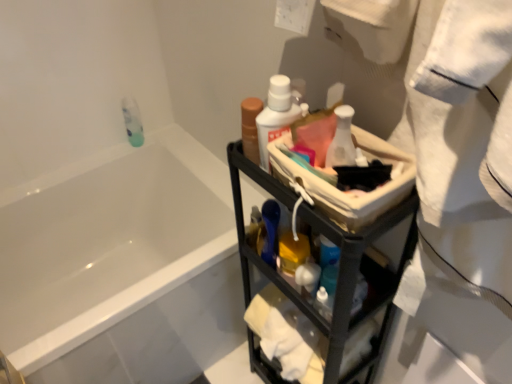
Locate an element on the screen. Image resolution: width=512 pixels, height=384 pixels. matte brown bottle at upper right, which is counted as the second mouthwash, starting from the right is located at coordinates (250, 127).

The image size is (512, 384). Describe the element at coordinates (340, 265) in the screenshot. I see `black metal cart at center` at that location.

Image resolution: width=512 pixels, height=384 pixels. What are the coordinates of `matte brown bottle at upper right, which ranks as the second mouthwash in back-to-front order` in the screenshot? It's located at (250, 127).

Which object is positioned more to the left, black metal cart at center or white glossy bathtub at upper left?

white glossy bathtub at upper left is more to the left.

Is white glossy bathtub at upper left surrounded by black metal cart at center?

No, white glossy bathtub at upper left is not inside black metal cart at center.

Locate an element on the screen. The height and width of the screenshot is (384, 512). bathtub below the black metal cart at center (from a real-world perspective) is located at coordinates (122, 266).

From the image's perspective, which is above, black metal cart at center or white glossy bathtub at upper left?

From the image's view, white glossy bathtub at upper left is above.

Is white cotton towel at right not within white glossy bottle at center?

white cotton towel at right is positioned outside white glossy bottle at center.

Considering the positions of objects white cotton towel at right and white glossy bottle at center in the image provided, who is behind, white cotton towel at right or white glossy bottle at center?

white glossy bottle at center is further away from the camera.

Between white cotton towel at right and white glossy bottle at center, which one has larger width?

Wider between the two is white cotton towel at right.

From the image's perspective, is white cotton towel at right positioned above or below white glossy bottle at center?

From the image's perspective, white cotton towel at right appears below white glossy bottle at center.

Between point (344, 234) and point (345, 112), which one is positioned in front?

The point (344, 234) is in front.

Is there a large distance between black metal cart at center and white glossy bottle at center?

No, there isn't a large distance between black metal cart at center and white glossy bottle at center.

Consider the image. Considering the sizes of objects black metal cart at center and white glossy bottle at center in the image provided, who is smaller, black metal cart at center or white glossy bottle at center?

white glossy bottle at center.

Which object is positioned more to the left, black metal cart at center or white glossy bottle at center?

From the viewer's perspective, white glossy bottle at center appears more on the left side.

From the image's perspective, is black metal cart at center on top of white cotton towel at right?

Incorrect, from the image's perspective, black metal cart at center is lower than white cotton towel at right.

Does black metal cart at center appear on the left side of white cotton towel at right?

Yes, black metal cart at center is to the left of white cotton towel at right.

At what (x,y) coordinates should I click in order to perform the action: click on bath towel lying on the right of black metal cart at center. Please return your answer as a coordinate pair (x, y). Looking at the image, I should click on (462, 177).

Does point (267, 370) appear closer or farther from the camera than point (408, 78)?

Point (267, 370).

Could you tell me if matte brown bottle at upper right, the second mouthwash positioned from the left, is turned towards white glossy bathtub at upper left?

No, matte brown bottle at upper right, the second mouthwash positioned from the left, is not aimed at white glossy bathtub at upper left.

Is matte brown bottle at upper right, which ranks as the second mouthwash in back-to-front order, outside of white glossy bathtub at upper left?

That's correct, matte brown bottle at upper right, which ranks as the second mouthwash in back-to-front order, is outside of white glossy bathtub at upper left.

Which object is positioned more to the right, matte brown bottle at upper right, the 2th mouthwash when ordered from front to back, or white glossy bathtub at upper left?

From the viewer's perspective, matte brown bottle at upper right, the 2th mouthwash when ordered from front to back, appears more on the right side.

Would you say matte brown bottle at upper right, the second mouthwash positioned from the left, is inside or outside white glossy bottle at center?

matte brown bottle at upper right, the second mouthwash positioned from the left, cannot be found inside white glossy bottle at center.

In the scene shown: In the image, is matte brown bottle at upper right, the 2th mouthwash when ordered from front to back, positioned in front of or behind white glossy bottle at center?

matte brown bottle at upper right, the 2th mouthwash when ordered from front to back, is positioned farther from the viewer than white glossy bottle at center.

From the image's perspective, which object appears higher, matte brown bottle at upper right, which ranks as the second mouthwash in back-to-front order, or white glossy bottle at center?

From the image's view, matte brown bottle at upper right, which ranks as the second mouthwash in back-to-front order, is above.

Is white glossy bathtub at upper left taller or shorter than white glossy bottle at upper center, which appears as the 3th mouthwash when viewed from the back?

Clearly, white glossy bathtub at upper left is taller compared to white glossy bottle at upper center, which appears as the 3th mouthwash when viewed from the back.

Is white glossy bathtub at upper left at the right side of white glossy bottle at upper center, which appears as the 3th mouthwash when viewed from the back?

In fact, white glossy bathtub at upper left is to the left of white glossy bottle at upper center, which appears as the 3th mouthwash when viewed from the back.

Is white glossy bathtub at upper left inside the boundaries of white glossy bottle at upper center, which is the third mouthwash in left-to-right order, or outside?

white glossy bathtub at upper left cannot be found inside white glossy bottle at upper center, which is the third mouthwash in left-to-right order.

The image size is (512, 384). I want to click on furniture on the right of white glossy bathtub at upper left, so click(x=340, y=265).

Locate an element on the screen. The height and width of the screenshot is (384, 512). toiletry behind the white cotton towel at right is located at coordinates (342, 140).

Looking at the image, which one is located further to white glossy bathtub at upper left, white cotton towel at right or black metal cart at center?

white cotton towel at right lies further to white glossy bathtub at upper left than the other object.

When comparing their distances from translucent plastic mouthwash at upper left, the 3th mouthwash from the right, does matte brown bottle at upper right, which ranks as the second mouthwash in back-to-front order, or white glossy bottle at upper center, which appears as the 3th mouthwash when viewed from the back, seem further?

Based on the image, white glossy bottle at upper center, which appears as the 3th mouthwash when viewed from the back, appears to be further to translucent plastic mouthwash at upper left, the 3th mouthwash from the right.

Considering their positions, is white glossy bottle at center positioned further to white glossy bathtub at upper left than translucent plastic mouthwash at upper left, the 3th mouthwash from the right?

The object further to white glossy bathtub at upper left is white glossy bottle at center.

Based on their spatial positions, is black metal cart at center or translucent plastic mouthwash at upper left, which appears as the third mouthwash when viewed from the front, closer to white glossy bottle at center?

The object closer to white glossy bottle at center is black metal cart at center.

From the image, which object appears to be farther from translucent plastic mouthwash at upper left, the 1th mouthwash from the back, white cotton towel at right or black metal cart at center?

white cotton towel at right is further to translucent plastic mouthwash at upper left, the 1th mouthwash from the back.

Considering their positions, is white glossy bathtub at upper left positioned closer to white glossy bottle at center than black metal cart at center?

The object closer to white glossy bottle at center is black metal cart at center.

Looking at the image, which one is located further to translucent plastic mouthwash at upper left, the 3th mouthwash from the right, white glossy bathtub at upper left or white glossy bottle at center?

Among the two, white glossy bottle at center is located further to translucent plastic mouthwash at upper left, the 3th mouthwash from the right.

Based on their spatial positions, is white cotton towel at right or matte brown bottle at upper right, the second mouthwash positioned from the left, further from white glossy bathtub at upper left?

white cotton towel at right.

You are a GUI agent. You are given a task and a screenshot of the screen. Output one action in this format:
    pyautogui.click(x=<x>, y=<y>)
    Task: Click on the bathtub positioned between black metal cart at center and translucent plastic mouthwash at upper left, the 1th mouthwash from the back, from near to far
    The width and height of the screenshot is (512, 384).
    Given the screenshot: What is the action you would take?
    pyautogui.click(x=122, y=266)

At what (x,y) coordinates should I click in order to perform the action: click on mouthwash between white cotton towel at right and matte brown bottle at upper right, which ranks as the second mouthwash in back-to-front order, in the front-back direction. Please return your answer as a coordinate pair (x, y). Looking at the image, I should click on (275, 115).

You are a GUI agent. You are given a task and a screenshot of the screen. Output one action in this format:
    pyautogui.click(x=<x>, y=<y>)
    Task: Click on the bathtub between white cotton towel at right and translucent plastic mouthwash at upper left, which appears as the third mouthwash when viewed from the front, in the front-back direction
    The width and height of the screenshot is (512, 384).
    Given the screenshot: What is the action you would take?
    pyautogui.click(x=122, y=266)

Where is `bathtub between white glossy bottle at center and translucent plastic mouthwash at upper left, the 3th mouthwash from the right, from front to back`? This screenshot has width=512, height=384. bathtub between white glossy bottle at center and translucent plastic mouthwash at upper left, the 3th mouthwash from the right, from front to back is located at coordinates (x=122, y=266).